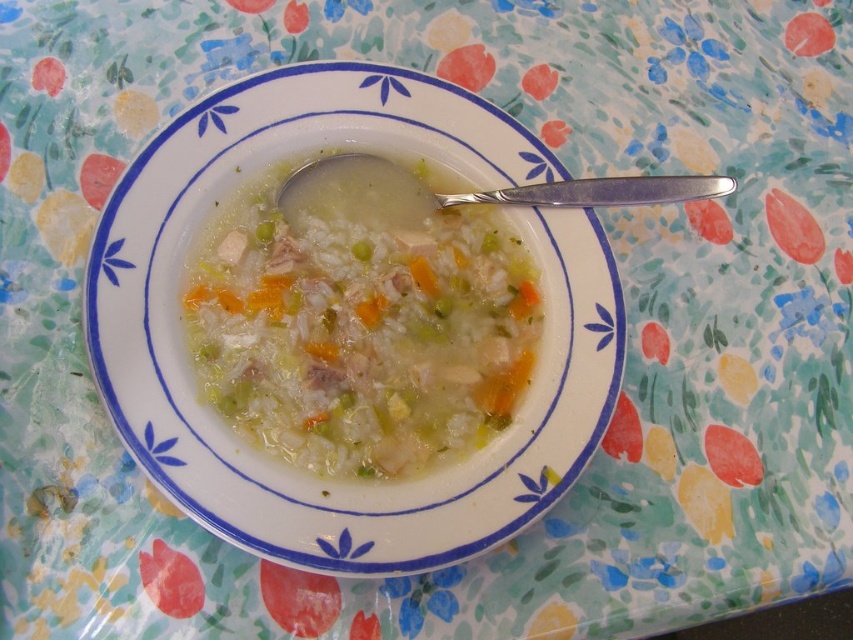
Question: Is white creamy soup at center below silver metallic spoon at center?

Choices:
 (A) yes
 (B) no

Answer: (A)

Question: Which object is farther from the camera taking this photo?

Choices:
 (A) white creamy soup at center
 (B) silver metallic spoon at center

Answer: (B)

Question: Which object is farther from the camera taking this photo?

Choices:
 (A) white creamy soup at center
 (B) silver metallic spoon at center

Answer: (B)

Question: Does white creamy soup at center appear on the right side of silver metallic spoon at center?

Choices:
 (A) yes
 (B) no

Answer: (B)

Question: Does white creamy soup at center appear under silver metallic spoon at center?

Choices:
 (A) no
 (B) yes

Answer: (B)